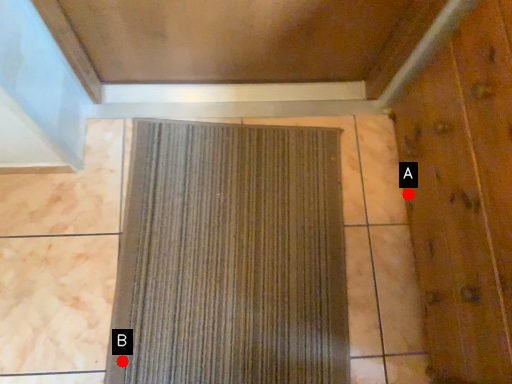
Question: Two points are circled on the image, labeled by A and B beside each circle. Among these points, which one is nearest to the camera?

Choices:
 (A) A is closer
 (B) B is closer

Answer: (B)